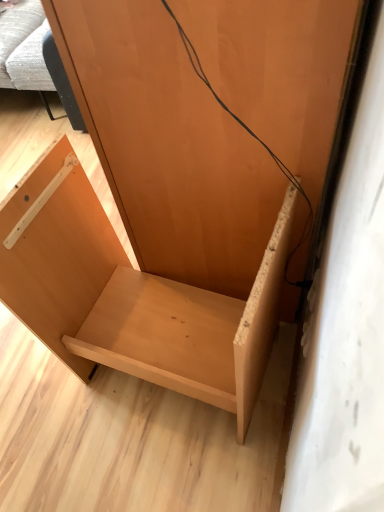
You are a GUI agent. You are given a task and a screenshot of the screen. Output one action in this format:
    pyautogui.click(x=<x>, y=<y>)
    Task: Click on the free location in front of light wood shelf at lower left
    Image resolution: width=384 pixels, height=512 pixels.
    Given the screenshot: What is the action you would take?
    pyautogui.click(x=177, y=464)